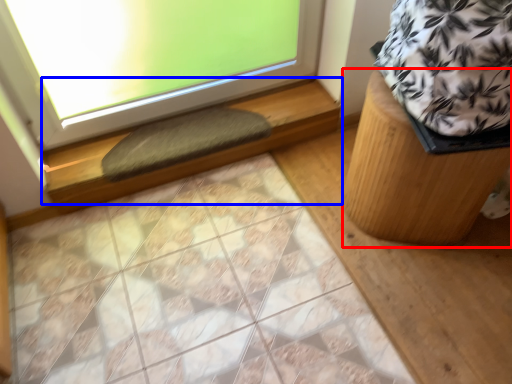
Question: Which object is further to the camera taking this photo, furniture (highlighted by a red box) or window sill (highlighted by a blue box)?

Choices:
 (A) furniture
 (B) window sill

Answer: (B)